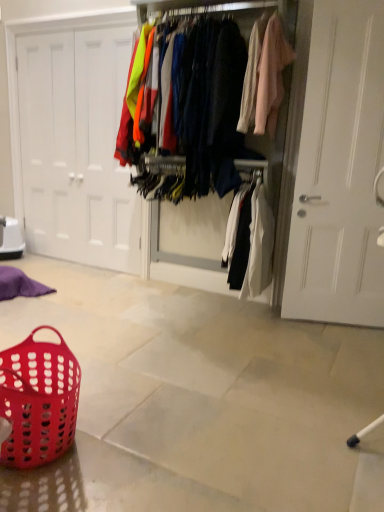
Question: Is white matte door at left positioned beyond the bounds of translucent red plastic basket at lower left?

Choices:
 (A) no
 (B) yes

Answer: (B)

Question: Does white matte door at left lie in front of translucent red plastic basket at lower left?

Choices:
 (A) yes
 (B) no

Answer: (B)

Question: Is there a large distance between white matte door at left and translucent red plastic basket at lower left?

Choices:
 (A) yes
 (B) no

Answer: (A)

Question: From a real-world perspective, does white matte door at left sit lower than translucent red plastic basket at lower left?

Choices:
 (A) yes
 (B) no

Answer: (B)

Question: Can you confirm if white matte door at left is taller than translucent red plastic basket at lower left?

Choices:
 (A) no
 (B) yes

Answer: (B)

Question: Is translucent red plastic basket at lower left at the back of white matte door at left?

Choices:
 (A) yes
 (B) no

Answer: (B)

Question: Does white matte door at left have a lesser width compared to matte fabric clothes at center?

Choices:
 (A) yes
 (B) no

Answer: (A)

Question: Does white matte door at left lie behind matte fabric clothes at center?

Choices:
 (A) yes
 (B) no

Answer: (A)

Question: Is white matte door at left completely or partially outside of matte fabric clothes at center?

Choices:
 (A) no
 (B) yes

Answer: (B)

Question: From a real-world perspective, is white matte door at left located beneath matte fabric clothes at center?

Choices:
 (A) yes
 (B) no

Answer: (A)

Question: Considering the relative sizes of white matte door at left and matte fabric clothes at center in the image provided, is white matte door at left bigger than matte fabric clothes at center?

Choices:
 (A) yes
 (B) no

Answer: (B)

Question: Is white matte door at left not close to matte fabric clothes at center?

Choices:
 (A) yes
 (B) no

Answer: (A)

Question: From the image's perspective, is translucent red plastic basket at lower left on top of matte fabric clothes at center?

Choices:
 (A) no
 (B) yes

Answer: (A)